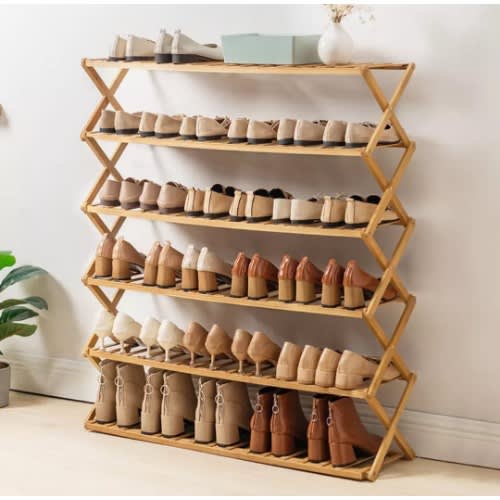
Find the location of a particular element. This screenshot has width=500, height=500. shelves is located at coordinates (288, 464), (300, 388), (314, 311), (320, 232), (327, 151), (313, 69).